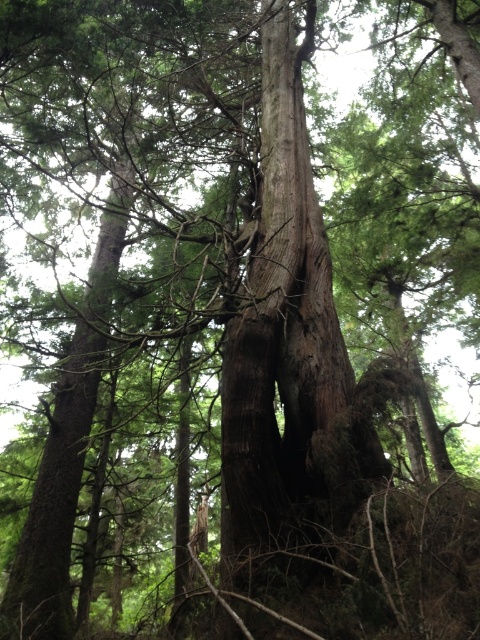
Which is above, smooth brown bark at center or smooth brown tree trunk at center?

Positioned higher is smooth brown bark at center.

Does smooth brown bark at center have a greater width compared to smooth brown tree trunk at center?

Indeed, smooth brown bark at center has a greater width compared to smooth brown tree trunk at center.

This screenshot has height=640, width=480. In order to click on smooth brown bark at center in this screenshot , I will do `click(289, 346)`.